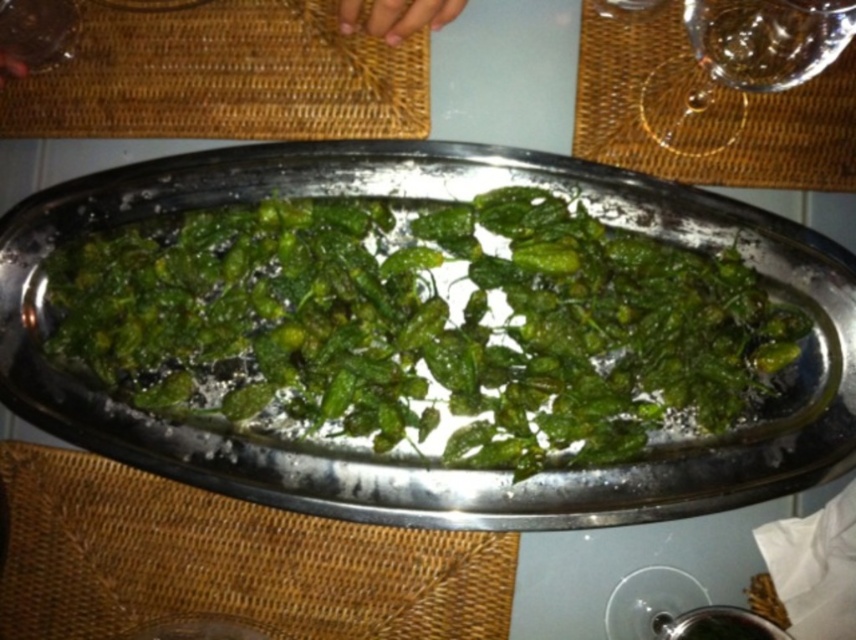
Question: Which point is closer to the camera?

Choices:
 (A) green leafy vegetable at center
 (B) transparent glass at upper right

Answer: (B)

Question: Is green leafy vegetable at center thinner than transparent glass at upper right?

Choices:
 (A) no
 (B) yes

Answer: (A)

Question: In this image, where is green leafy vegetable at center located relative to transparent glass at upper right?

Choices:
 (A) below
 (B) above

Answer: (A)

Question: Which point appears farthest from the camera in this image?

Choices:
 (A) (669, 145)
 (B) (676, 269)

Answer: (A)

Question: Is green leafy vegetable at center wider than transparent glass at upper right?

Choices:
 (A) yes
 (B) no

Answer: (A)